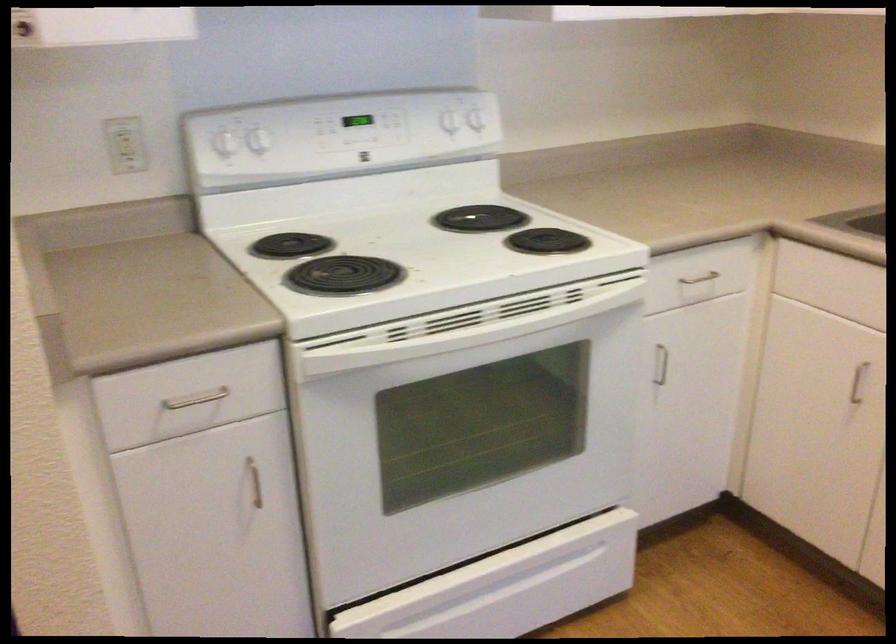
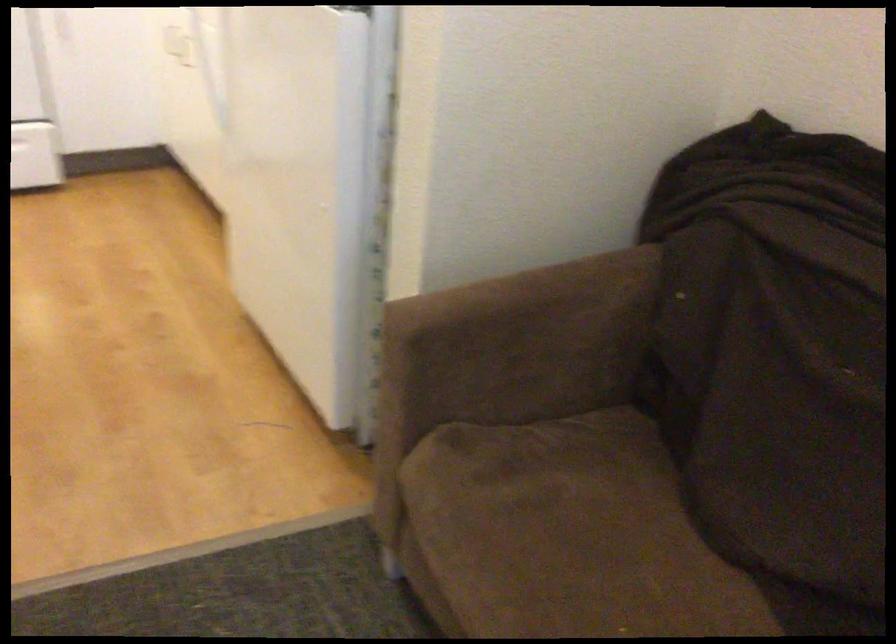
What movement of the cameraman would produce the second image?

The cameraman moved toward right, backward.